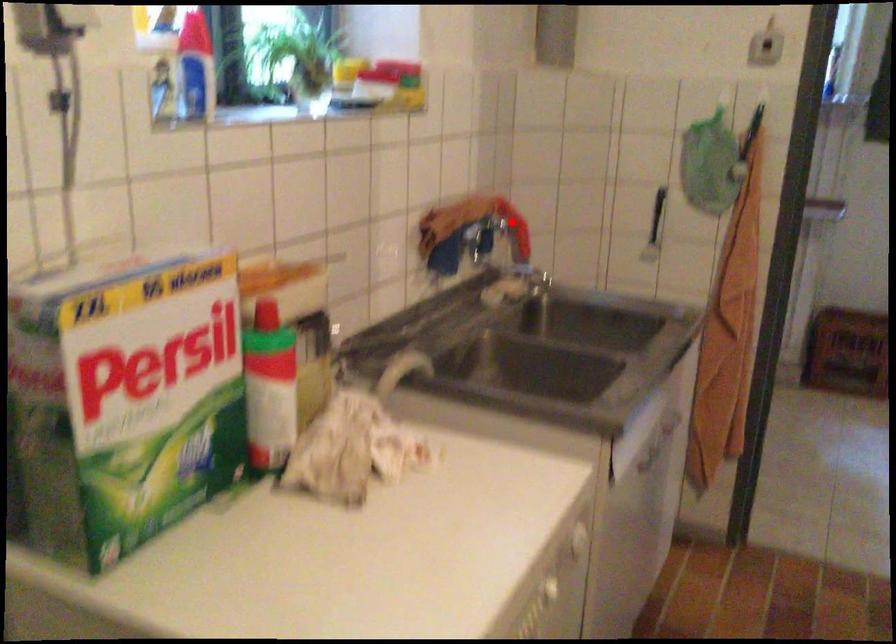
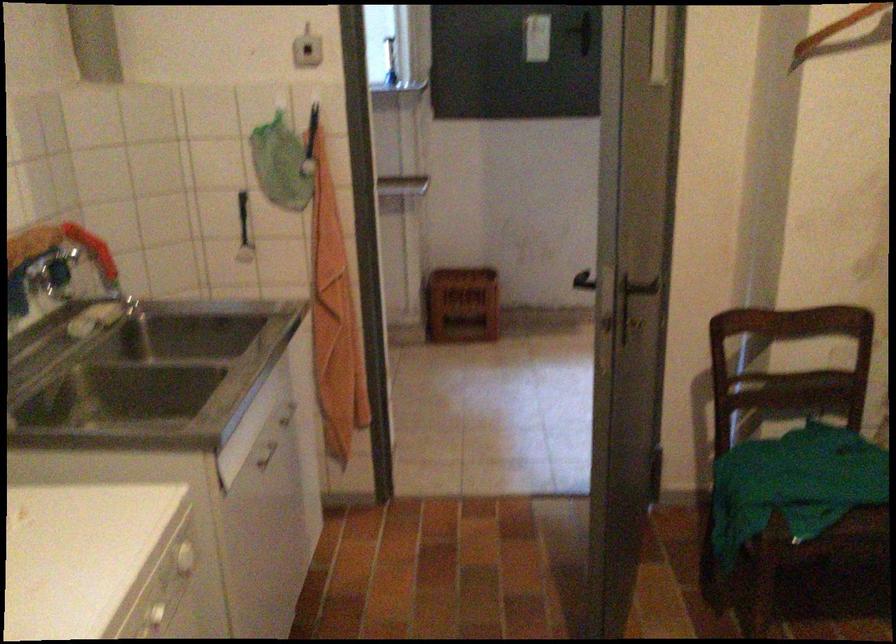
The point at the highlighted location is marked in the first image. Where is the corresponding point in the second image?

(91, 249)